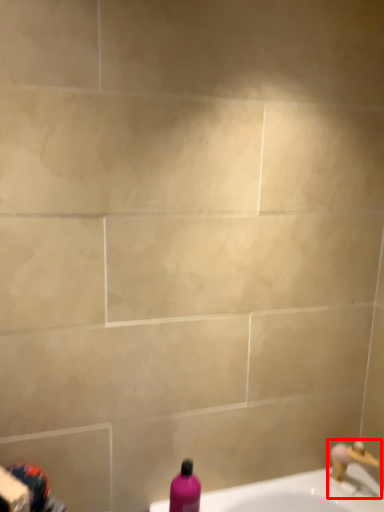
Question: Considering the relative positions of tap (annotated by the red box) and bottle in the image provided, where is tap (annotated by the red box) located with respect to the staircase?

Choices:
 (A) right
 (B) left

Answer: (A)